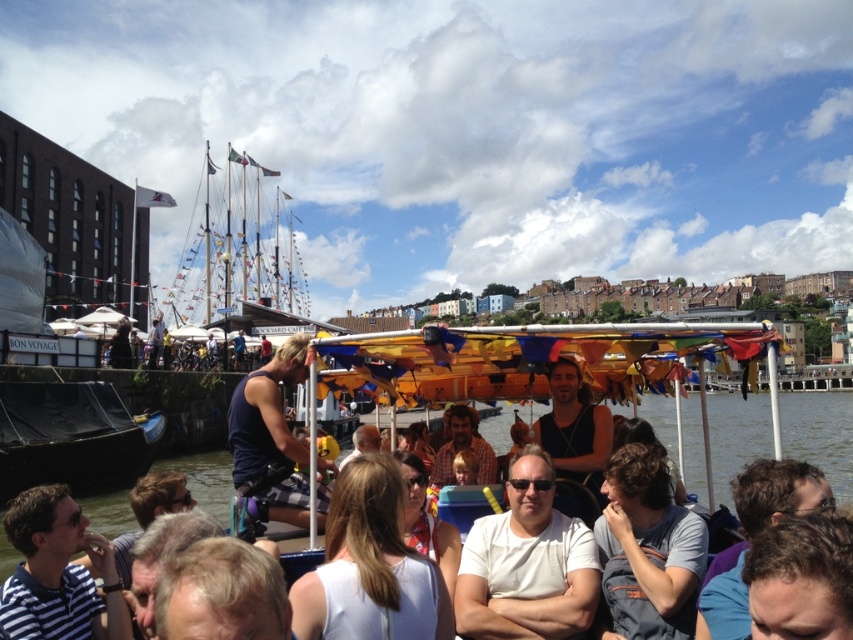
Does black matte boat at left lie in front of dark blue sleeveless shirt at center?

No, black matte boat at left is behind dark blue sleeveless shirt at center.

From the picture: Does black matte boat at left come behind dark blue sleeveless shirt at center?

That is True.

Which is behind, point (51, 340) or point (236, 440)?

The point (51, 340) is behind.

Where is `black matte boat at left`? The width and height of the screenshot is (853, 640). black matte boat at left is located at coordinates (70, 436).

Does white matte t-shirt at center have a lesser width compared to gray cotton shirt at center?

No.

The image size is (853, 640). Find the location of `white matte t-shirt at center`. white matte t-shirt at center is located at coordinates (527, 563).

Identify the location of white matte t-shirt at center. The image size is (853, 640). (527, 563).

Who is taller, white matte t-shirt at center or dark blue sleeveless shirt at center?

dark blue sleeveless shirt at center

Does point (552, 580) come behind point (235, 419)?

No, (552, 580) is closer to viewer.

The height and width of the screenshot is (640, 853). Identify the location of white matte t-shirt at center. (527, 563).